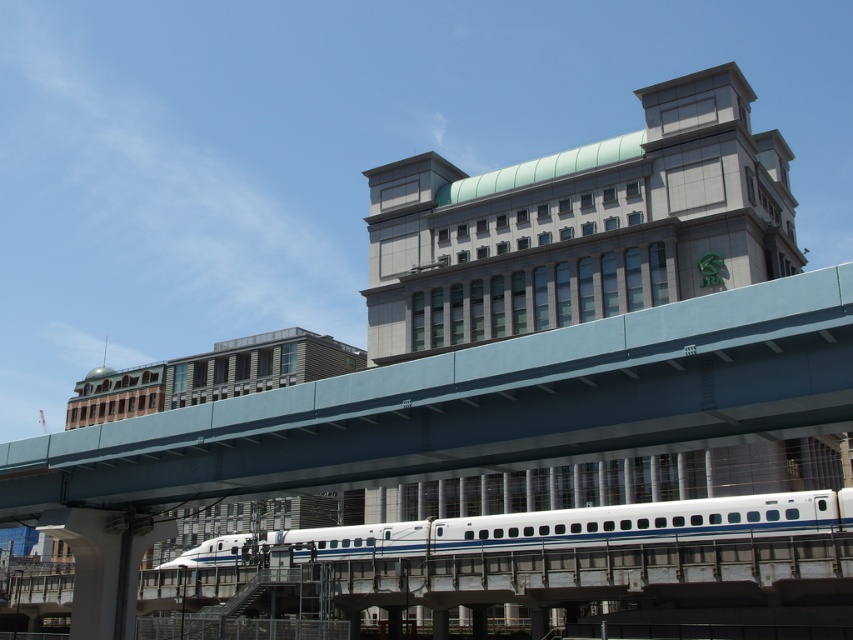
Can you confirm if smooth concrete overpass at center is wider than white glossy passenger train at center?

No.

Is point (784, 394) in front of point (171, 563)?

Yes.

Does point (590, 404) lie in front of point (848, 486)?

That is True.

Locate an element on the screen. This screenshot has width=853, height=640. smooth concrete overpass at center is located at coordinates click(479, 406).